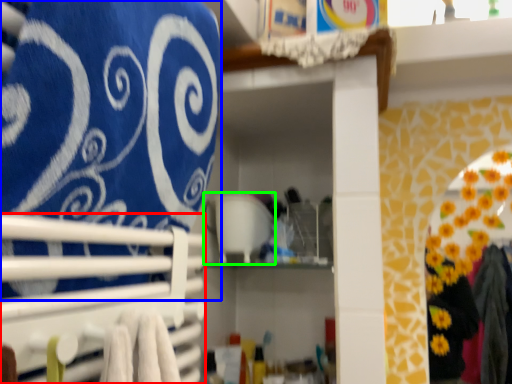
Question: Based on their relative distances, which object is nearer to closet (highlighted by a red box)? Choose from bath towel (highlighted by a blue box) and appliance (highlighted by a green box).

Choices:
 (A) bath towel
 (B) appliance

Answer: (A)